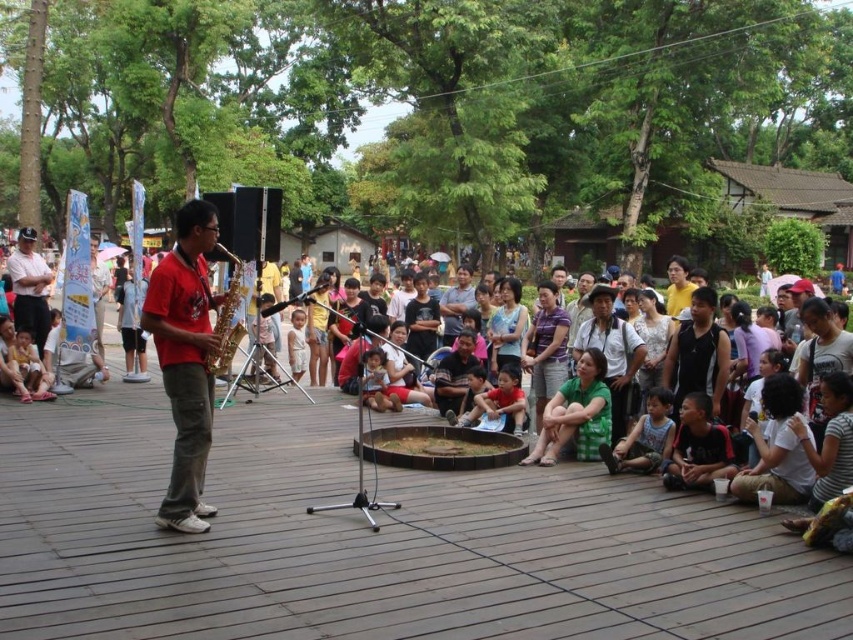
Is matte green clothing at center bigger than matte black shirt at upper left?

Yes, matte green clothing at center is bigger than matte black shirt at upper left.

Which is in front, point (308, 340) or point (27, 285)?

Positioned in front is point (27, 285).

Locate an element on the screen. The image size is (853, 640). matte green clothing at center is located at coordinates (651, 342).

Between matte green clothing at center and red matte saxophone at left, which one has less height?

Standing shorter between the two is red matte saxophone at left.

The height and width of the screenshot is (640, 853). What are the coordinates of `matte green clothing at center` in the screenshot? It's located at (651, 342).

Locate an element on the screen. matte green clothing at center is located at coordinates (651, 342).

Who is lower down, red matte saxophone at left or matte black shirt at upper left?

red matte saxophone at left is lower down.

Is red matte saxophone at left above matte black shirt at upper left?

No, red matte saxophone at left is not above matte black shirt at upper left.

Is point (200, 291) less distant than point (24, 308)?

That is True.

Locate an element on the screen. Image resolution: width=853 pixels, height=640 pixels. red matte saxophone at left is located at coordinates (184, 358).